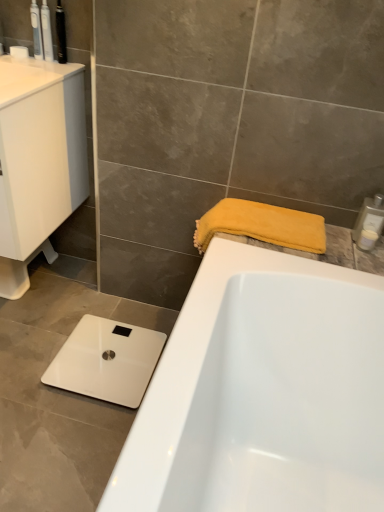
Find the location of `free point in front of white plastic soap dispenser at upper right, the fifth toiletry when ordered from left to right`. free point in front of white plastic soap dispenser at upper right, the fifth toiletry when ordered from left to right is located at coordinates (361, 258).